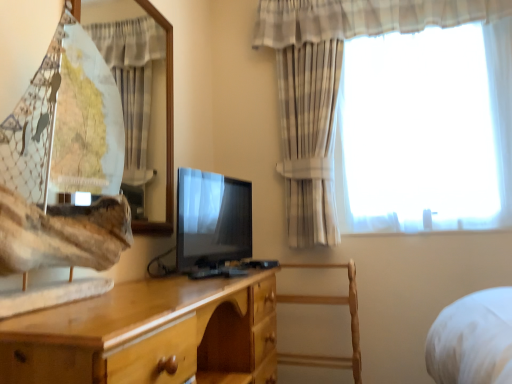
Question: Based on their sizes in the image, would you say wooden chair at center is bigger or smaller than matte black tv at center?

Choices:
 (A) big
 (B) small

Answer: (A)

Question: Considering the positions of wooden chair at center and matte black tv at center in the image, is wooden chair at center wider or thinner than matte black tv at center?

Choices:
 (A) thin
 (B) wide

Answer: (B)

Question: Estimate the real-world distances between objects in this image. Which object is farther from the plaid fabric curtain at upper left, acting as the second curtain starting from the right?

Choices:
 (A) light wood chest of drawers at center
 (B) matte black tv at center
 (C) wooden chair at center
 (D) plaid fabric curtain at upper right, the second curtain in the left-to-right sequence

Answer: (C)

Question: Based on their relative distances, which object is farther from the light wood chest of drawers at center?

Choices:
 (A) wooden chair at center
 (B) plaid fabric curtain at upper right, the second curtain in the left-to-right sequence
 (C) plaid fabric curtain at upper left, acting as the second curtain starting from the right
 (D) matte black tv at center

Answer: (C)